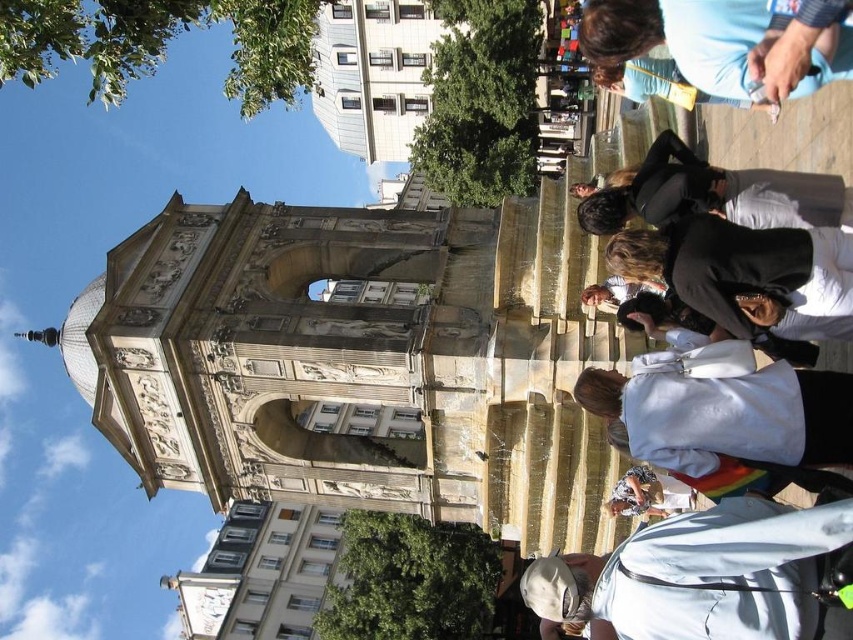
You are standing at the center of the fountain in the image. You see a point marked at coordinates [723,412]. What object is located at this point?

The point at coordinates [723,412] indicates the white cotton shirt at lower right.

In the scene shown: A tourist is standing at point (689, 275) and wants to take a photo of the fountain. If the camera can only focus on objects within 30 meters, will they be able to capture the fountain clearly?

The tourist at point (689, 275) is 30.86 meters away from the fountain. Since the camera can only focus within 30 meters, the tourist will not be able to capture the fountain clearly as they are slightly beyond the focus range.

You are a photographer trying to capture both the black matte jacket at center and the black leather jacket at upper right in a single shot. Based on their positions, which jacket is closer to the camera?

The black matte jacket at center is closer to the camera because it is positioned below the black leather jacket at upper right, indicating it is in a lower plane relative to the viewer.